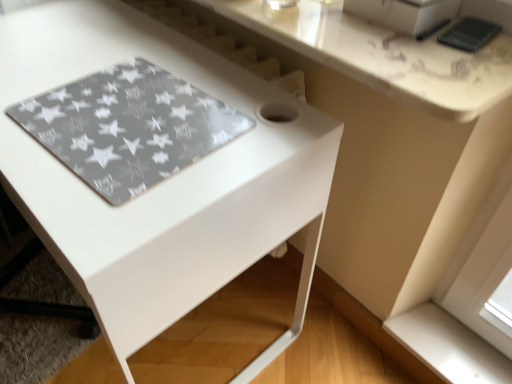
Where is `empty space that is to the right of transparent star-patterned mat at lower left`? This screenshot has width=512, height=384. empty space that is to the right of transparent star-patterned mat at lower left is located at coordinates (250, 126).